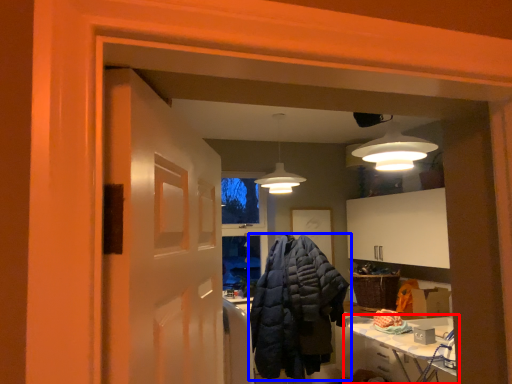
Question: Which object is further to the camera taking this photo, table (highlighted by a red box) or jacket (highlighted by a blue box)?

Choices:
 (A) table
 (B) jacket

Answer: (B)